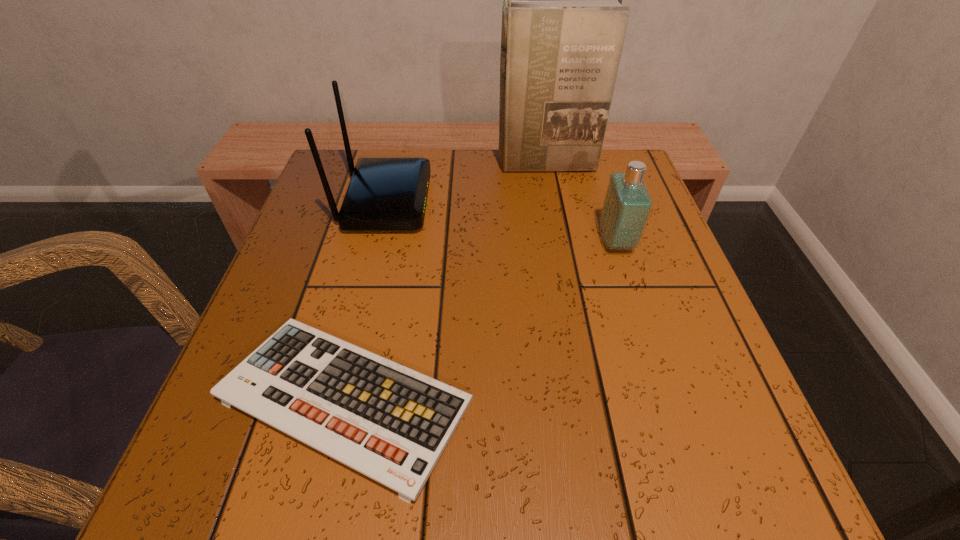
You are a GUI agent. You are given a task and a screenshot of the screen. Output one action in this format:
    pyautogui.click(x=<x>, y=<y>)
    Task: Click on the free location that satisfies the following two spatial constraints: 1. on the front-facing side of the router; 2. on the right side of the shortest object
    The height and width of the screenshot is (540, 960).
    Given the screenshot: What is the action you would take?
    pyautogui.click(x=337, y=400)

You are a GUI agent. You are given a task and a screenshot of the screen. Output one action in this format:
    pyautogui.click(x=<x>, y=<y>)
    Task: Click on the vacant area that satisfies the following two spatial constraints: 1. on the front-facing side of the second tallest object; 2. on the right side of the shortest object
    
    Given the screenshot: What is the action you would take?
    pyautogui.click(x=337, y=400)